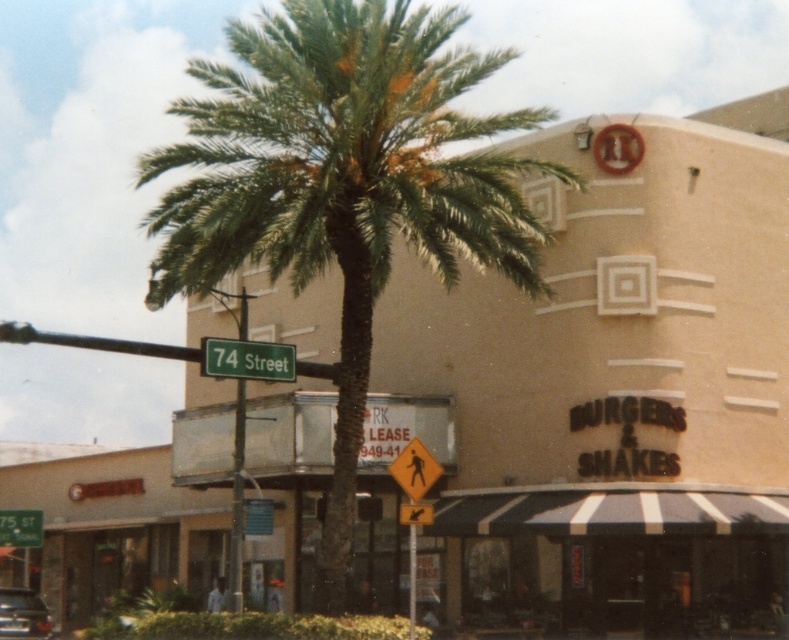
Consider the image. Measure the distance between point (559, 508) and camera.

Point (559, 508) and camera are 26.65 meters apart from each other.

You are a GUI agent. You are given a task and a screenshot of the screen. Output one action in this format:
    pyautogui.click(x=<x>, y=<y>)
    Task: Click on the black striped awning at lower center
    
    Given the screenshot: What is the action you would take?
    pyautogui.click(x=621, y=557)

Locate an element on the screen. The image size is (789, 640). green leafy palm tree at center is located at coordinates (342, 184).

Describe the element at coordinates (342, 184) in the screenshot. This screenshot has height=640, width=789. I see `green leafy palm tree at center` at that location.

Does point (513, 253) come closer to viewer compared to point (13, 522)?

Yes, it is in front of point (13, 522).

Where is `green leafy palm tree at center`? The image size is (789, 640). green leafy palm tree at center is located at coordinates (342, 184).

Is point (253, 342) farther from viewer compared to point (40, 534)?

No, it is in front of (40, 534).

Locate an element on the screen. The image size is (789, 640). green matte street sign at upper center is located at coordinates (247, 358).